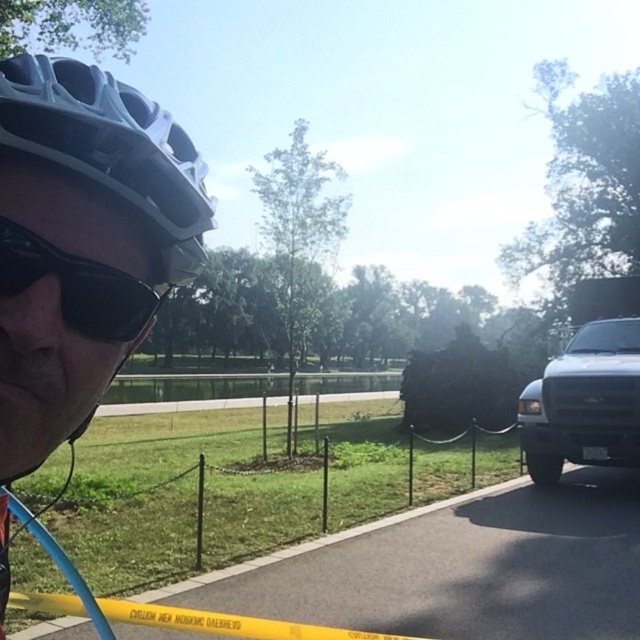
You are a pedestrian standing on the pathway. You see the white matte helmet at upper left and the black matte truck at right. Which object is closer to you?

The white matte helmet at upper left is closer to you because it is smaller than the black matte truck at right, indicating it is farther away.

You are a cyclist who wants to check if your white matte helmet at upper left is properly placed on your head while wearing your black matte sunglasses at upper left. Based on the scene, is the helmet positioned correctly relative to the sunglasses?

The white matte helmet at upper left is positioned on the left side of black matte sunglasses at upper left, which means the helmet is placed correctly on your head as it should be, since helmets are typically worn over the head and sunglasses sit lower on the face.

You are a pedestrian standing at the center of the image. You see a black matte truck at right and a black matte sunglasses at upper left. Which object is closer to you?

The black matte sunglasses at upper left is closer to you since it is only 27.46 feet away from the black matte truck at right, which is farther away.